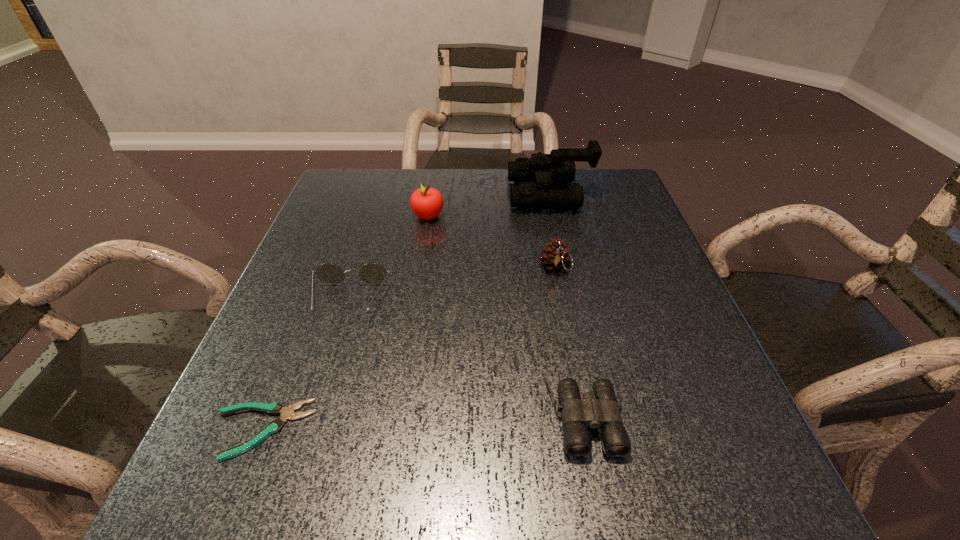
In the image, there is a desktop. Where is `vacant space at the right edge`? This screenshot has width=960, height=540. vacant space at the right edge is located at coordinates (680, 426).

Where is `vacant space at the far left corner of the desktop`? vacant space at the far left corner of the desktop is located at coordinates (360, 183).

This screenshot has width=960, height=540. Find the location of `blank region between the taller binoculars and the fourth tallest object`. blank region between the taller binoculars and the fourth tallest object is located at coordinates (450, 248).

The height and width of the screenshot is (540, 960). I want to click on vacant point located between the nearer binoculars and the third object from left to right, so click(x=503, y=304).

I want to click on blank region between the pliers and the third nearest object, so click(x=306, y=366).

This screenshot has height=540, width=960. Find the location of `free point between the third shortest object and the pinecone`. free point between the third shortest object and the pinecone is located at coordinates (452, 285).

Where is `blank region between the farther binoculars and the pinecone`? blank region between the farther binoculars and the pinecone is located at coordinates (553, 232).

Identify the location of vacant space that's between the nearer binoculars and the pinecone. This screenshot has height=540, width=960. (566, 330).

Where is `free area in between the third shortest object and the farther binoculars`? The width and height of the screenshot is (960, 540). free area in between the third shortest object and the farther binoculars is located at coordinates (450, 248).

I want to click on free space between the farther binoculars and the fourth tallest object, so click(450, 248).